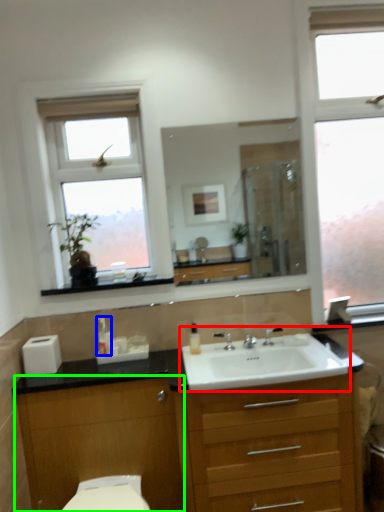
Question: Estimate the real-world distances between objects in this image. Which object is farther from sink (highlighted by a red box), soap dispenser (highlighted by a blue box) or cabinetry (highlighted by a green box)?

Choices:
 (A) soap dispenser
 (B) cabinetry

Answer: (A)